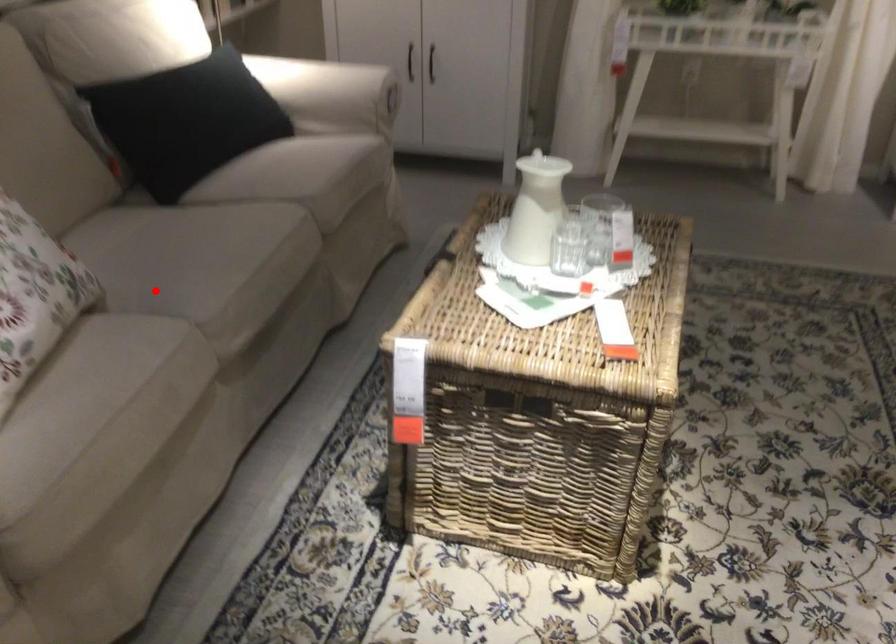
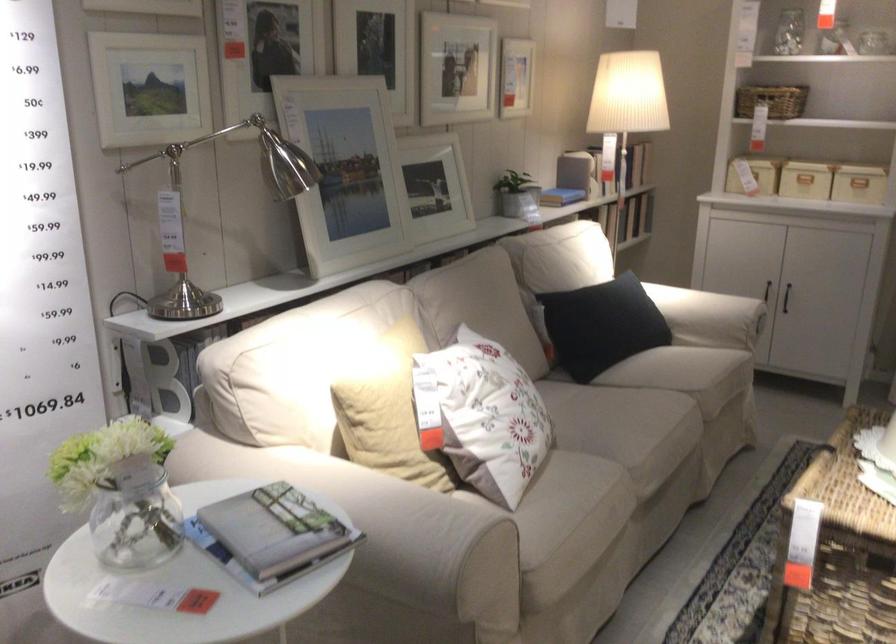
Question: I am providing you with two images of the same scene from different viewpoints. Given a red point in image1, look at the same physical point in image2. Is it:

Choices:
 (A) Closer to the viewpoint
 (B) Farther from the viewpoint

Answer: (B)